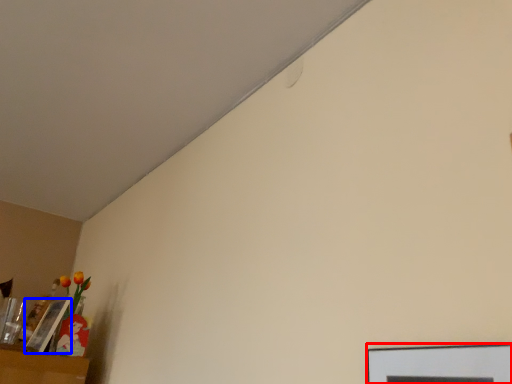
Question: Among these objects, which one is nearest to the camera, picture frame (highlighted by a red box) or picture frame (highlighted by a blue box)?

Choices:
 (A) picture frame
 (B) picture frame

Answer: (A)